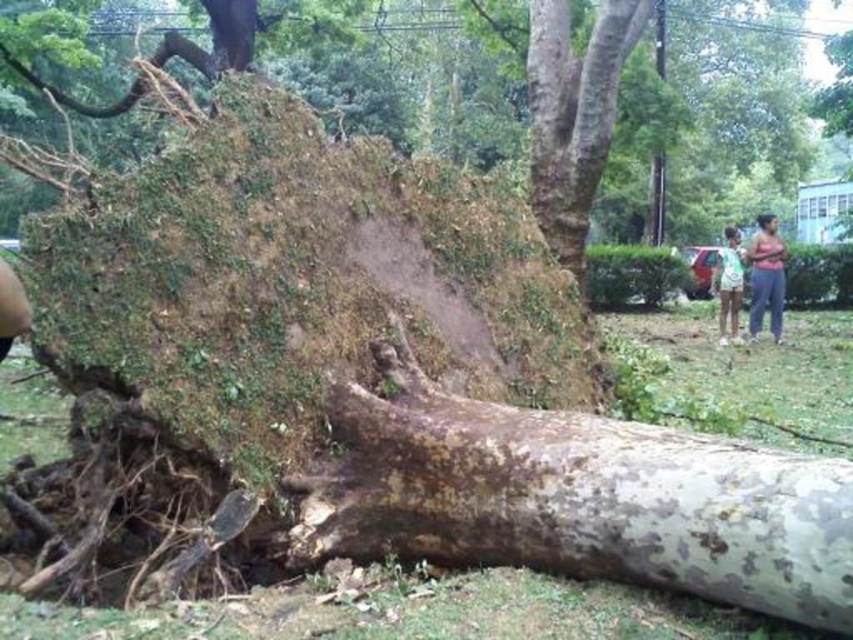
You are standing at the point marked as point (573, 115) in the image. Looking around, you see the brown rough bark tree trunk at upper center. What is the nearest object to you in the scene?

The nearest object to you is the brown rough bark tree trunk at upper center because you are standing at its location marked by point (573, 115).

You are a park maintenance worker assessing the fallen tree. You notice the brown rough bark tree trunk at upper center and the green fabric shirt at right. Which object takes up more area in the image?

The green fabric shirt at right takes up more area in the image than the brown rough bark tree trunk at upper center according to the description.

From the picture: You are a park visitor who wants to take a photo of the brown rough bark tree trunk at upper center without including the pink fabric shirt at right in the frame. Based on their positions, which direction should you move to achieve this?

The brown rough bark tree trunk at upper center is to the left of the pink fabric shirt at right. To exclude the pink fabric shirt at right from the photo, move to the right side of the pink fabric shirt at right so that the tree trunk remains in view while the shirt is out of frame.